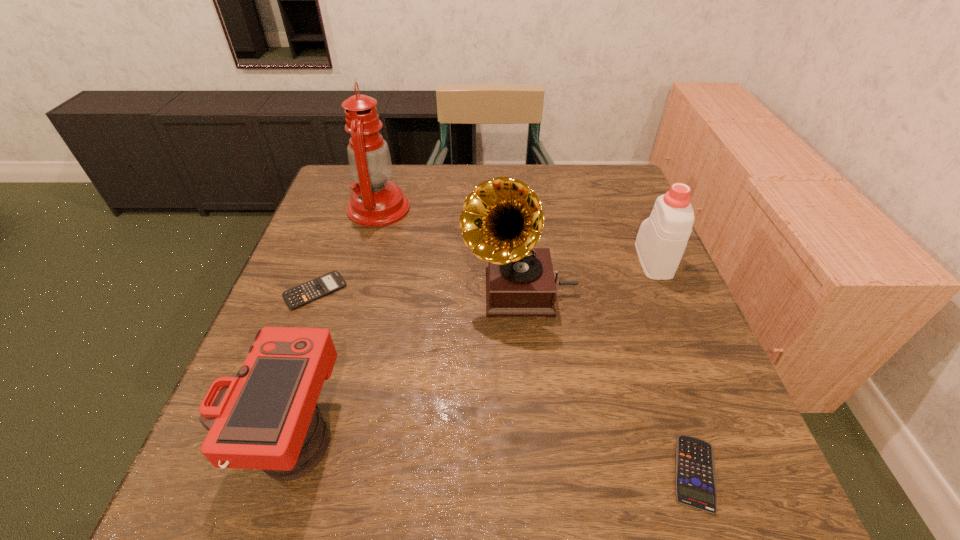
Locate an element on the screen. The width and height of the screenshot is (960, 540). vacant point located 0.310m from the horn of the third object from right to left is located at coordinates (324, 291).

Image resolution: width=960 pixels, height=540 pixels. I want to click on free point located 0.090m from the horn of the third object from right to left, so click(422, 291).

Locate an element on the screen. blank space located from the horn of the third object from right to left is located at coordinates (409, 291).

You are a GUI agent. You are given a task and a screenshot of the screen. Output one action in this format:
    pyautogui.click(x=<x>, y=<y>)
    Task: Click on the vacant space located 0.150m on the handle side of the detergent
    
    Given the screenshot: What is the action you would take?
    pyautogui.click(x=631, y=207)

You are a GUI agent. You are given a task and a screenshot of the screen. Output one action in this format:
    pyautogui.click(x=<x>, y=<y>)
    Task: Click on the free location located on the handle side of the detergent
    Image resolution: width=960 pixels, height=540 pixels.
    Given the screenshot: What is the action you would take?
    pyautogui.click(x=629, y=203)

This screenshot has width=960, height=540. I want to click on vacant point located 0.170m on the handle side of the detergent, so click(x=629, y=203).

Image resolution: width=960 pixels, height=540 pixels. Find the location of `vacant space located 0.240m on the right of the third shortest object`. vacant space located 0.240m on the right of the third shortest object is located at coordinates (478, 434).

Locate an element on the screen. The width and height of the screenshot is (960, 540). vacant point located on the front of the left calculator is located at coordinates tap(292, 352).

Locate an element on the screen. vacant region located 0.050m on the back of the right calculator is located at coordinates (673, 409).

The width and height of the screenshot is (960, 540). I want to click on object that is at the far edge, so click(376, 202).